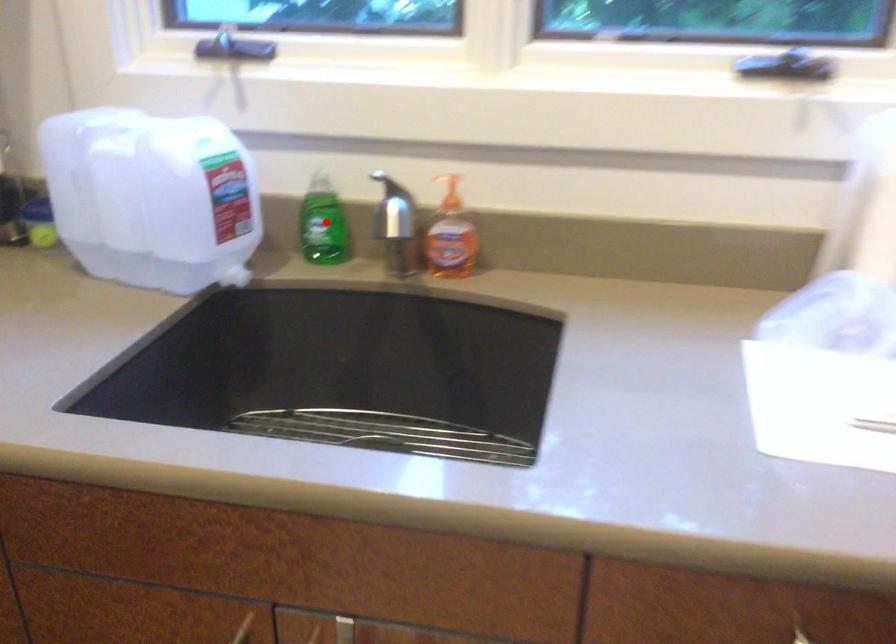
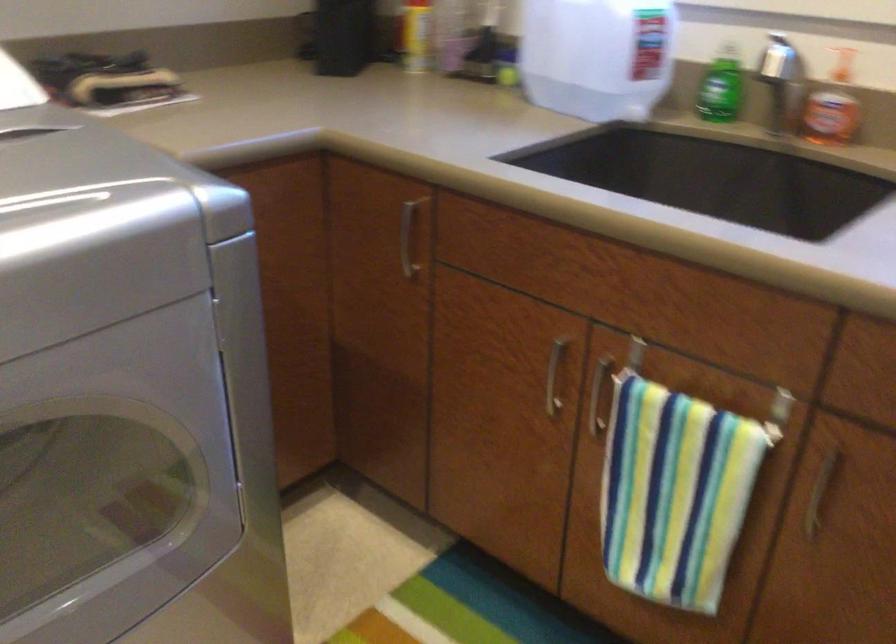
In the second image, find the point that corresponds to the highlighted location in the first image.

(721, 88)